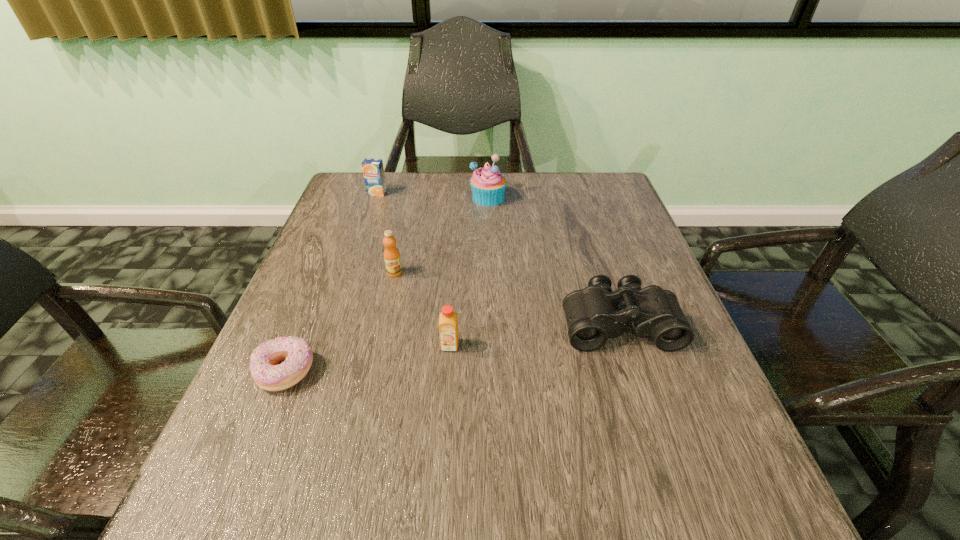
The width and height of the screenshot is (960, 540). Identify the location of vacant point located 0.200m on the right of the leftmost orange juice. (454, 193).

Image resolution: width=960 pixels, height=540 pixels. Identify the location of vacant space located 0.230m on the front and back of the rightmost orange juice. (442, 470).

Find the location of a particular element. This screenshot has width=960, height=540. vacant area situated at the eyepieces of the rightmost object is located at coordinates (649, 416).

Identify the location of vacant space located on the front of the doughnut. This screenshot has width=960, height=540. (233, 502).

You are a GUI agent. You are given a task and a screenshot of the screen. Output one action in this format:
    pyautogui.click(x=<x>, y=<y>)
    Task: Click on the muffin positioned at the far edge
    The width and height of the screenshot is (960, 540).
    Given the screenshot: What is the action you would take?
    pyautogui.click(x=488, y=185)

You are a GUI agent. You are given a task and a screenshot of the screen. Output one action in this format:
    pyautogui.click(x=<x>, y=<y>)
    Task: Click on the orange_juice that is positioned at the far edge
    The height and width of the screenshot is (540, 960).
    Given the screenshot: What is the action you would take?
    pyautogui.click(x=373, y=171)

This screenshot has width=960, height=540. I want to click on orange_juice located at the left edge, so click(373, 171).

At what (x,y) coordinates should I click in order to perform the action: click on doughnut that is at the left edge. Please return your answer as a coordinate pair (x, y). The height and width of the screenshot is (540, 960). Looking at the image, I should click on (297, 353).

At what (x,y) coordinates should I click in order to perform the action: click on object present at the right edge. Please return your answer as a coordinate pair (x, y). This screenshot has height=540, width=960. Looking at the image, I should click on (592, 315).

You are a GUI agent. You are given a task and a screenshot of the screen. Output one action in this format:
    pyautogui.click(x=<x>, y=<y>)
    Task: Click on the object located in the far left corner section of the desktop
    
    Given the screenshot: What is the action you would take?
    pyautogui.click(x=373, y=171)